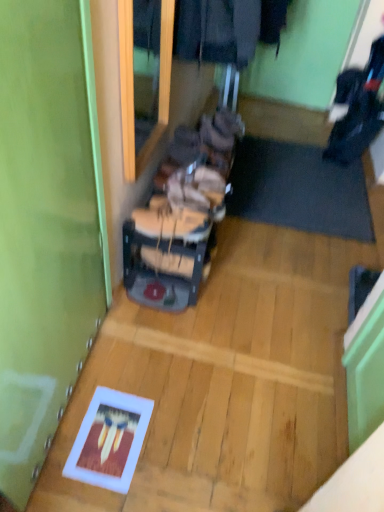
Describe the element at coordinates (46, 227) in the screenshot. I see `green matte cabinet at lower left` at that location.

Measure the distance between green matte cabinet at lower left and camera.

The depth of green matte cabinet at lower left is 27.19 inches.

Where is `green matte cabinet at lower left`? green matte cabinet at lower left is located at coordinates (46, 227).

You are a GUI agent. You are given a task and a screenshot of the screen. Output one action in this format:
    pyautogui.click(x=<x>, y=<y>)
    Task: Click on the green matte cabinet at lower left
    The image size is (384, 512).
    Given the screenshot: What is the action you would take?
    pyautogui.click(x=46, y=227)